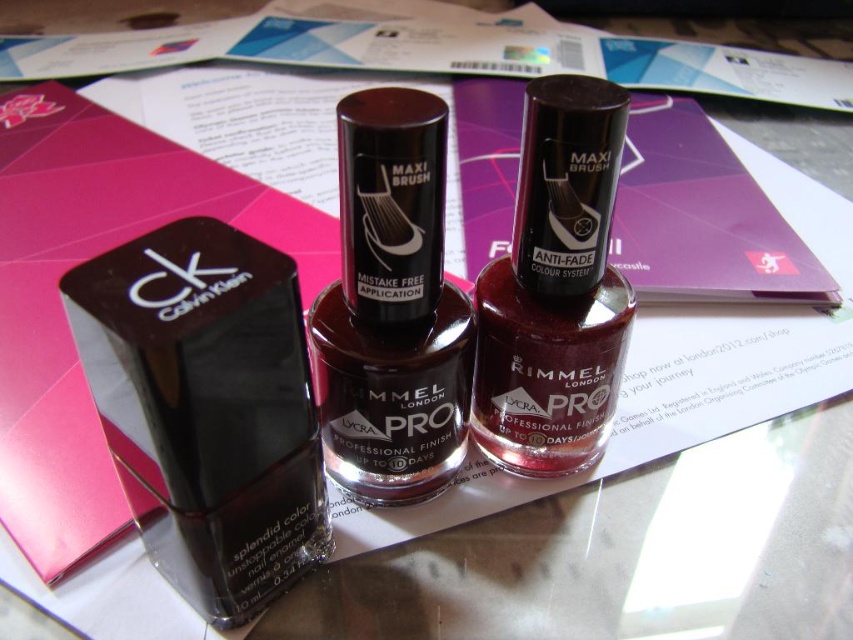
Which is behind, point (361, 294) or point (537, 388)?

Positioned behind is point (537, 388).

Does point (360, 429) lie behind point (602, 189)?

Yes, point (360, 429) is farther from viewer.

This screenshot has width=853, height=640. In order to click on satin burgundy nail polish at center in this screenshot , I will do point(392,308).

Does matte black nail polish at left appear on the right side of satin burgundy nail polish at center?

Incorrect, matte black nail polish at left is not on the right side of satin burgundy nail polish at center.

Does matte black nail polish at left have a lesser height compared to satin burgundy nail polish at center?

Yes, matte black nail polish at left is shorter than satin burgundy nail polish at center.

Where is `matte black nail polish at left`? The image size is (853, 640). matte black nail polish at left is located at coordinates (206, 408).

Does point (317, 440) come in front of point (579, 253)?

Yes, point (317, 440) is closer to viewer.

Who is more forward, [296,324] or [589,108]?

Point [296,324] is in front.

Locate an element on the screen. matte black nail polish at left is located at coordinates (206, 408).